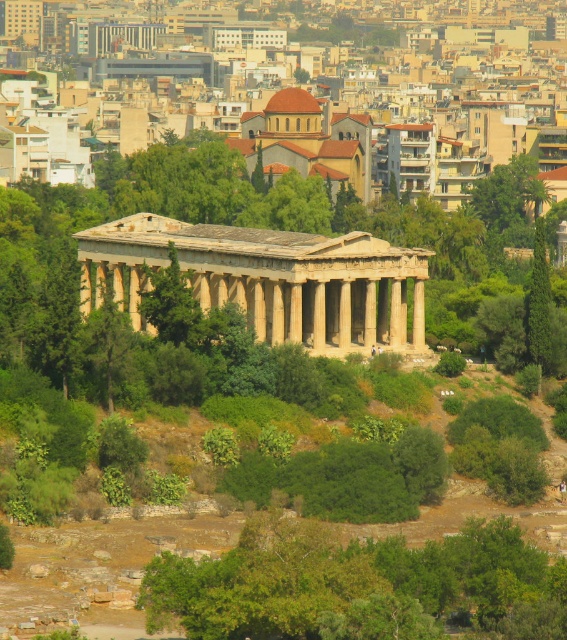
How far apart are green leafy tree at upper center and green leafy tree at center-right?

The distance of green leafy tree at upper center from green leafy tree at center-right is 12.32 meters.

Which is more to the left, green leafy tree at upper center or green leafy tree at center-right?

From the viewer's perspective, green leafy tree at center-right appears more on the left side.

Where is `green leafy tree at upper center`? green leafy tree at upper center is located at coordinates point(507,193).

The width and height of the screenshot is (567, 640). Describe the element at coordinates (268, 280) in the screenshot. I see `beige stone temple at center` at that location.

What do you see at coordinates (268, 280) in the screenshot? I see `beige stone temple at center` at bounding box center [268, 280].

At what (x,y) coordinates should I click in order to perform the action: click on beige stone temple at center. Please return your answer as a coordinate pair (x, y). Looking at the image, I should click on (268, 280).

Can you confirm if beige stone temple at center is shorter than green leafy tree at center?

No, beige stone temple at center is not shorter than green leafy tree at center.

Does beige stone temple at center have a greater width compared to green leafy tree at center?

Yes, beige stone temple at center is wider than green leafy tree at center.

Is point (261, 236) closer to viewer compared to point (171, 253)?

No, (261, 236) is behind (171, 253).

You are a GUI agent. You are given a task and a screenshot of the screen. Output one action in this format:
    pyautogui.click(x=<x>, y=<y>)
    Task: Click on the beige stone temple at center
    
    Given the screenshot: What is the action you would take?
    pyautogui.click(x=268, y=280)